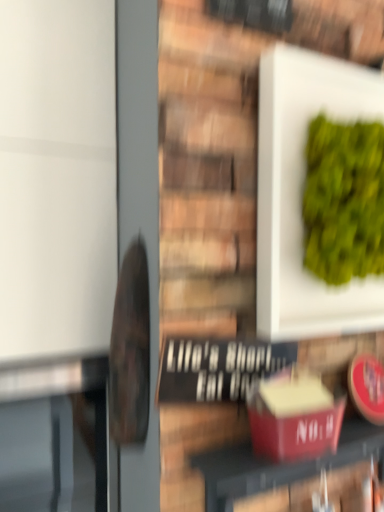
Question: Considering the positions of white matte plate at upper right and matte red box at center in the image, is white matte plate at upper right taller or shorter than matte red box at center?

Choices:
 (A) short
 (B) tall

Answer: (B)

Question: Looking at their shapes, would you say white matte plate at upper right is wider or thinner than matte red box at center?

Choices:
 (A) thin
 (B) wide

Answer: (B)

Question: From a real-world perspective, is white matte plate at upper right positioned above or below matte red box at center?

Choices:
 (A) above
 (B) below

Answer: (A)

Question: From their relative heights in the image, would you say matte red box at center is taller or shorter than white matte plate at upper right?

Choices:
 (A) tall
 (B) short

Answer: (B)

Question: Considering the positions of matte red box at center and white matte plate at upper right in the image, is matte red box at center bigger or smaller than white matte plate at upper right?

Choices:
 (A) small
 (B) big

Answer: (A)

Question: Considering their positions, is matte red box at center located in front of or behind white matte plate at upper right?

Choices:
 (A) behind
 (B) front

Answer: (B)

Question: Is point (379, 439) closer or farther from the camera than point (316, 309)?

Choices:
 (A) farther
 (B) closer

Answer: (A)